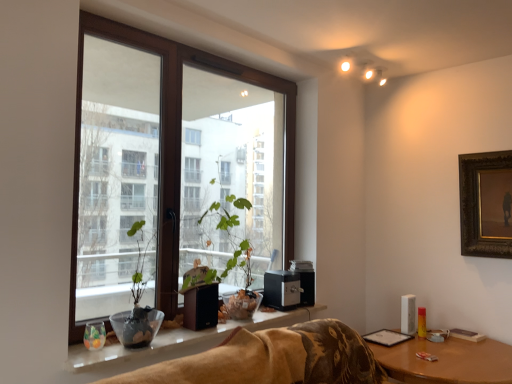
This screenshot has width=512, height=384. Identify the location of vacant region above white glossy window sill at lower center (from a real-world perspective). (203, 329).